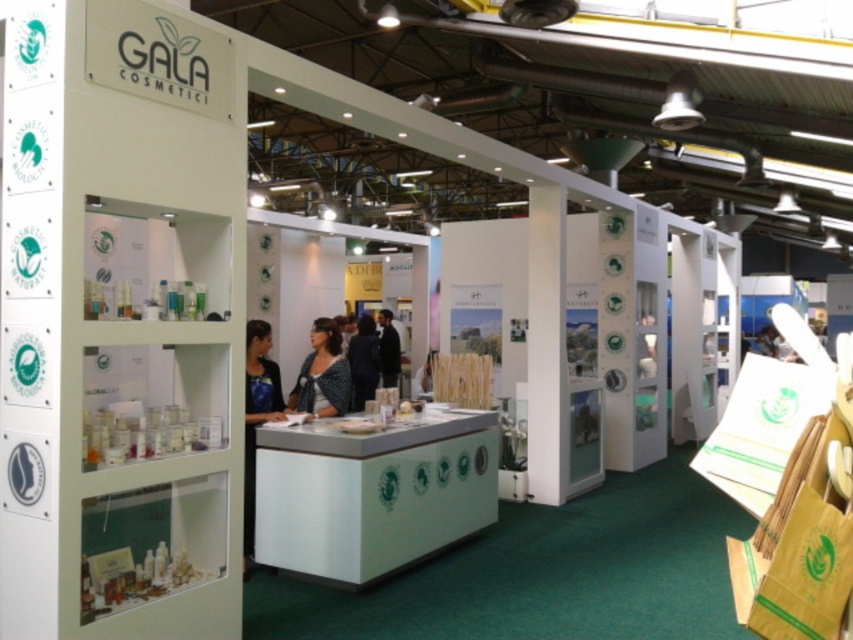
Question: Which of these objects is positioned farthest from the matte black shirt at center?

Choices:
 (A) black fabric at center
 (B) matte blue blouse at center

Answer: (A)

Question: Does matte blue blouse at center have a lesser width compared to black fabric at center?

Choices:
 (A) no
 (B) yes

Answer: (A)

Question: Considering the real-world distances, which object is farthest from the black fabric at center?

Choices:
 (A) matte black shirt at center
 (B) matte blue blouse at center

Answer: (A)

Question: Can you confirm if matte black shirt at center is smaller than black fabric at center?

Choices:
 (A) no
 (B) yes

Answer: (B)

Question: Does matte blue blouse at center have a smaller size compared to black fabric at center?

Choices:
 (A) yes
 (B) no

Answer: (A)

Question: Which of these objects is positioned farthest from the black fabric at center?

Choices:
 (A) matte black shirt at center
 (B) matte blue blouse at center

Answer: (A)